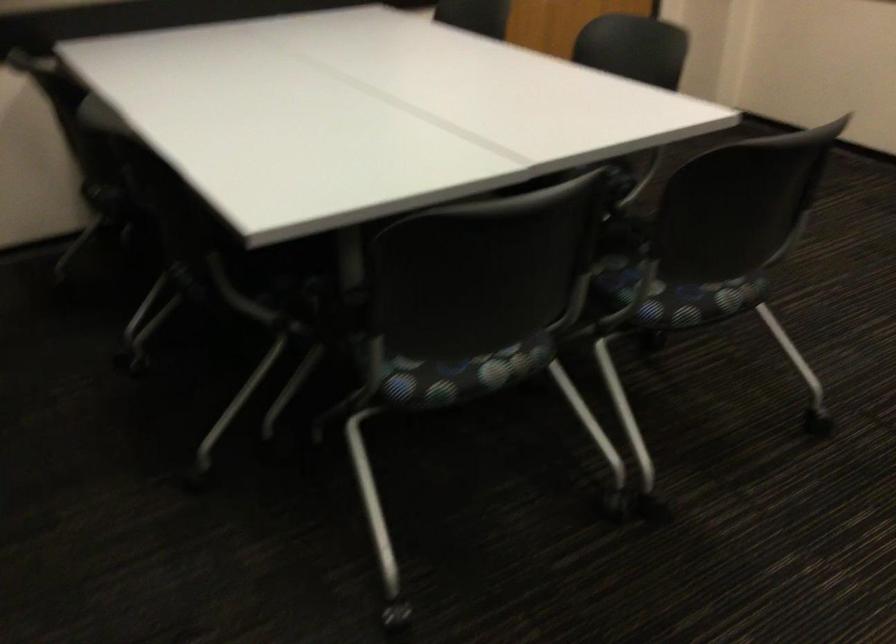
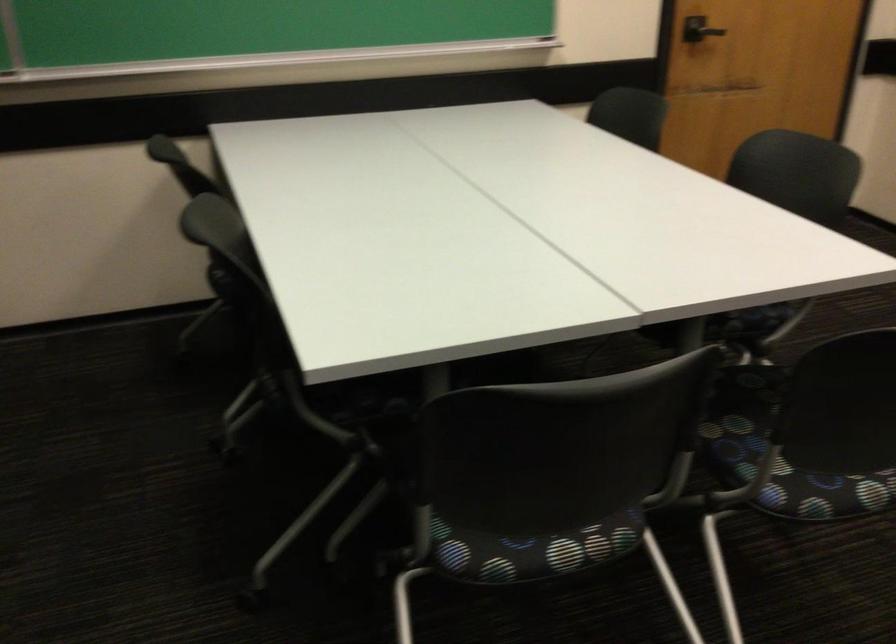
Question: The camera is either moving clockwise (left) or counter-clockwise (right) around the object. The first image is from the beginning of the video and the second image is from the end. Is the camera moving left or right when shooting the video?

Choices:
 (A) Left
 (B) Right

Answer: (B)